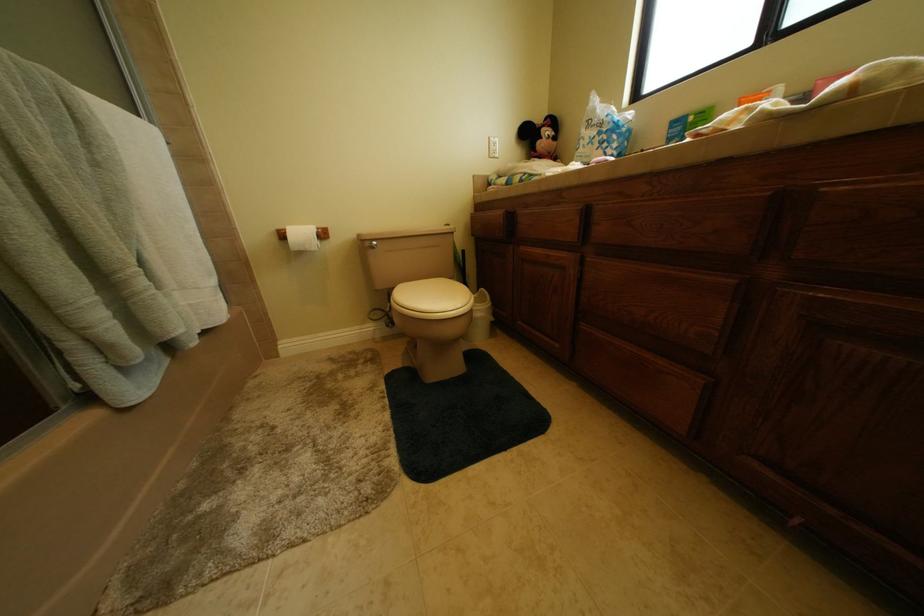
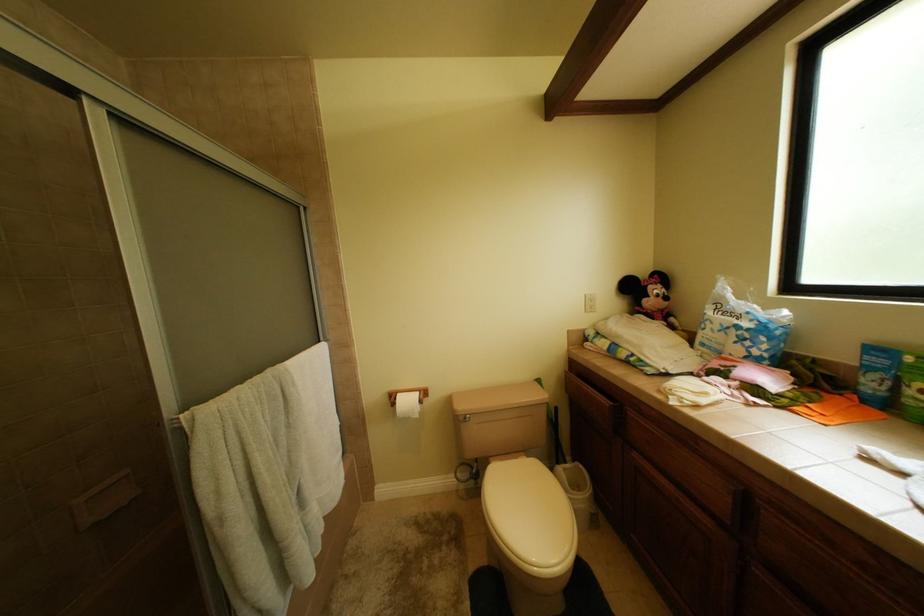
Question: The first image is from the beginning of the video and the second image is from the end. How did the camera likely rotate when shooting the video?

Choices:
 (A) Left
 (B) Right
 (C) Up
 (D) Down

Answer: (A)